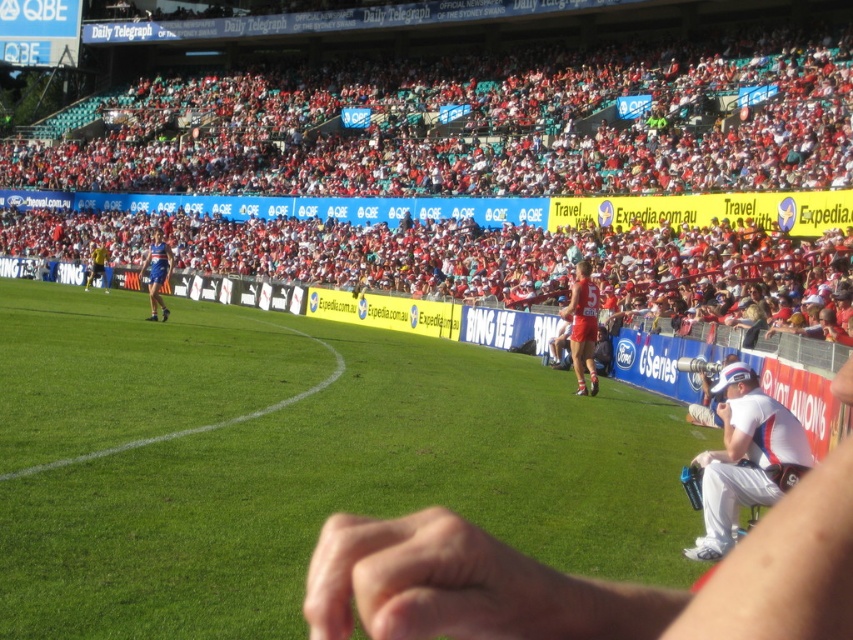
Question: Based on their relative distances, which object is farther from the white fabric cap at right?

Choices:
 (A) red jersey at center
 (B) blue fabric jersey at left

Answer: (B)

Question: Is white fabric cap at right below blue fabric jersey at left?

Choices:
 (A) yes
 (B) no

Answer: (A)

Question: Can you confirm if red jersey at center is thinner than blue fabric jersey at left?

Choices:
 (A) no
 (B) yes

Answer: (B)

Question: Which object is closer to the camera taking this photo?

Choices:
 (A) red jersey at center
 (B) blue fabric jersey at left

Answer: (A)

Question: Does red fabric seats at upper center appear on the left side of red jersey at center?

Choices:
 (A) yes
 (B) no

Answer: (A)

Question: Estimate the real-world distances between objects in this image. Which object is closer to the green grass at center?

Choices:
 (A) red fabric seats at upper center
 (B) blue fabric jersey at left

Answer: (B)